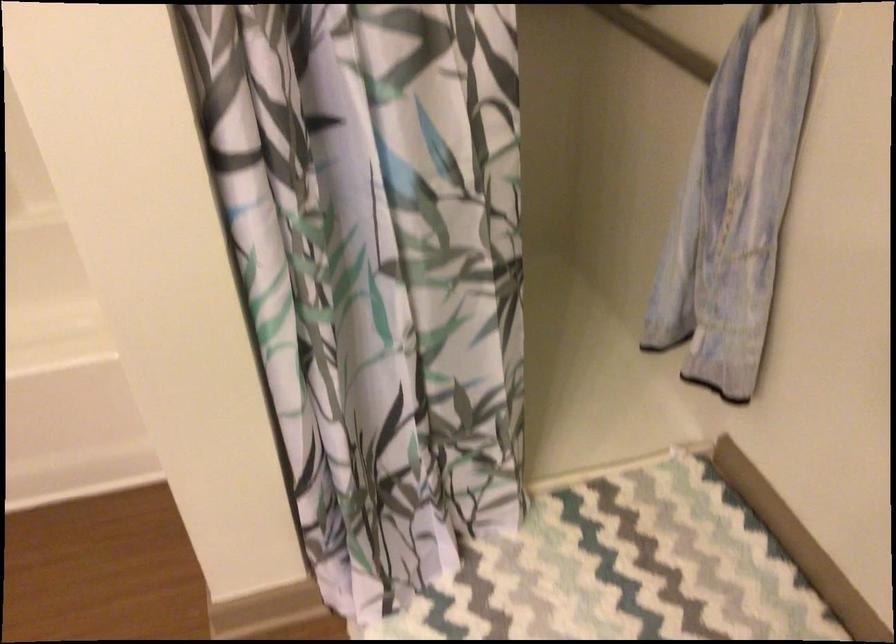
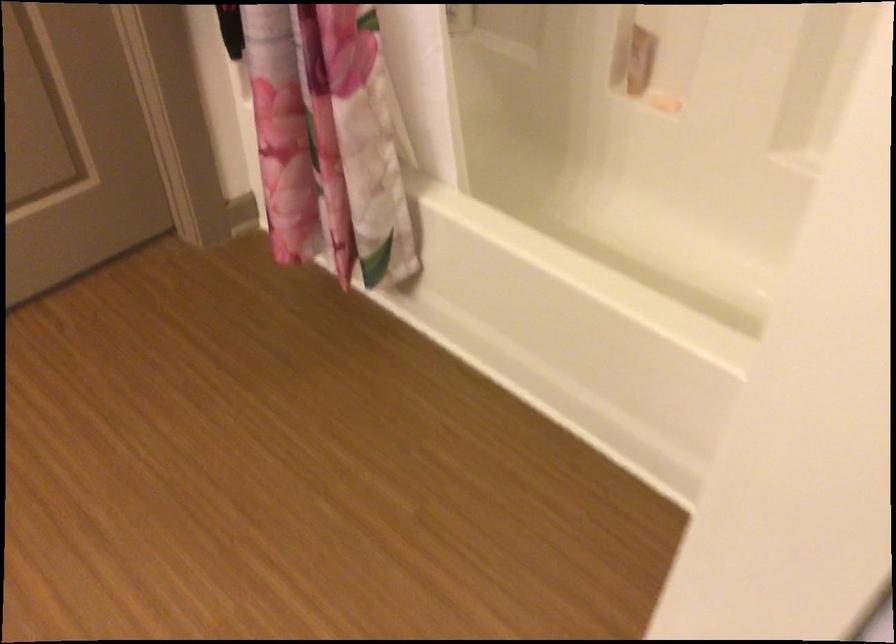
The images are taken continuously from a first-person perspective. In which direction is your viewpoint rotating?

The rotation direction of the camera is left-down.